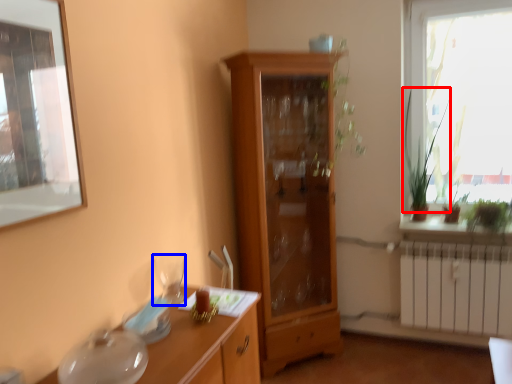
Question: Which object appears closest to the camera in this image, plant (highlighted by a red box) or tableware (highlighted by a blue box)?

Choices:
 (A) plant
 (B) tableware

Answer: (B)